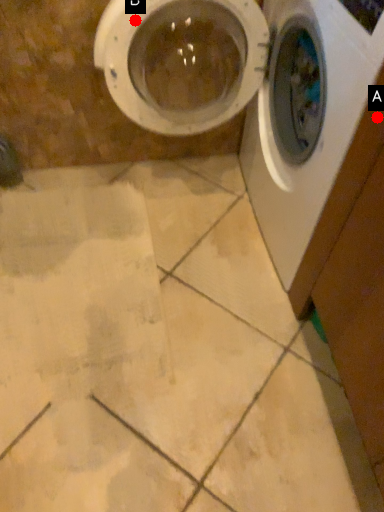
Question: Two points are circled on the image, labeled by A and B beside each circle. Which point is closer to the camera taking this photo?

Choices:
 (A) A is closer
 (B) B is closer

Answer: (A)